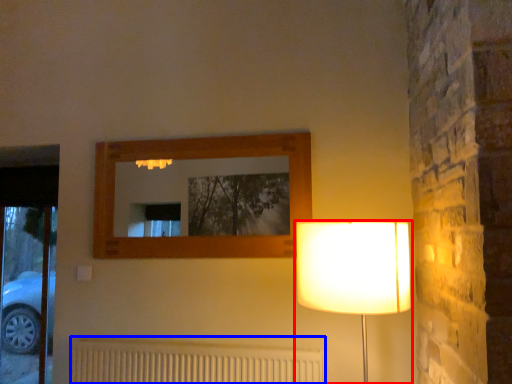
Question: Which object appears farthest to the camera in this image, lamp (highlighted by a red box) or radiator (highlighted by a blue box)?

Choices:
 (A) lamp
 (B) radiator

Answer: (B)